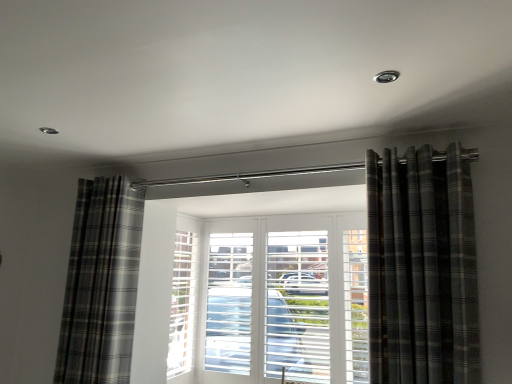
Question: From a real-world perspective, is plaid fabric curtain at left, positioned as the second curtain in front-to-back order, on plaid fabric curtain at right, which appears as the 1th curtain when viewed from the front?

Choices:
 (A) yes
 (B) no

Answer: (B)

Question: Does plaid fabric curtain at left, which is counted as the first curtain, starting from the left, have a greater width compared to plaid fabric curtain at right, which appears as the 1th curtain when viewed from the front?

Choices:
 (A) yes
 (B) no

Answer: (A)

Question: Would you say plaid fabric curtain at left, which appears as the 1th curtain when viewed from the back, is outside plaid fabric curtain at right, which is counted as the 2th curtain, starting from the left?

Choices:
 (A) yes
 (B) no

Answer: (A)

Question: Are plaid fabric curtain at left, the 2th curtain in the right-to-left sequence, and plaid fabric curtain at right, which appears as the 1th curtain when viewed from the front, beside each other?

Choices:
 (A) no
 (B) yes

Answer: (A)

Question: Does plaid fabric curtain at left, positioned as the second curtain in front-to-back order, appear on the left side of plaid fabric curtain at right, which appears as the 1th curtain when viewed from the front?

Choices:
 (A) no
 (B) yes

Answer: (B)

Question: Does plaid fabric curtain at left, positioned as the second curtain in front-to-back order, appear on the right side of plaid fabric curtain at right, which appears as the first curtain when viewed from the right?

Choices:
 (A) no
 (B) yes

Answer: (A)

Question: Is the position of plaid fabric curtain at right, which appears as the first curtain when viewed from the right, more distant than that of plaid fabric curtain at left, which is counted as the first curtain, starting from the left?

Choices:
 (A) no
 (B) yes

Answer: (A)

Question: From the image's perspective, is plaid fabric curtain at right, which appears as the 1th curtain when viewed from the front, located above plaid fabric curtain at left, the 2th curtain in the right-to-left sequence?

Choices:
 (A) no
 (B) yes

Answer: (B)

Question: Is plaid fabric curtain at right, which appears as the 2th curtain when viewed from the back, turned away from plaid fabric curtain at left, which appears as the 1th curtain when viewed from the back?

Choices:
 (A) no
 (B) yes

Answer: (A)

Question: Is plaid fabric curtain at right, which appears as the first curtain when viewed from the right, smaller than plaid fabric curtain at left, the 2th curtain in the right-to-left sequence?

Choices:
 (A) no
 (B) yes

Answer: (B)

Question: From a real-world perspective, does plaid fabric curtain at right, which appears as the first curtain when viewed from the right, stand above plaid fabric curtain at left, positioned as the second curtain in front-to-back order?

Choices:
 (A) no
 (B) yes

Answer: (B)

Question: Considering the relative sizes of plaid fabric curtain at right, which appears as the 2th curtain when viewed from the back, and plaid fabric curtain at left, which is counted as the first curtain, starting from the left, in the image provided, is plaid fabric curtain at right, which appears as the 2th curtain when viewed from the back, wider than plaid fabric curtain at left, which is counted as the first curtain, starting from the left,?

Choices:
 (A) no
 (B) yes

Answer: (A)

Question: Is point (133, 198) positioned closer to the camera than point (475, 301)?

Choices:
 (A) closer
 (B) farther

Answer: (B)